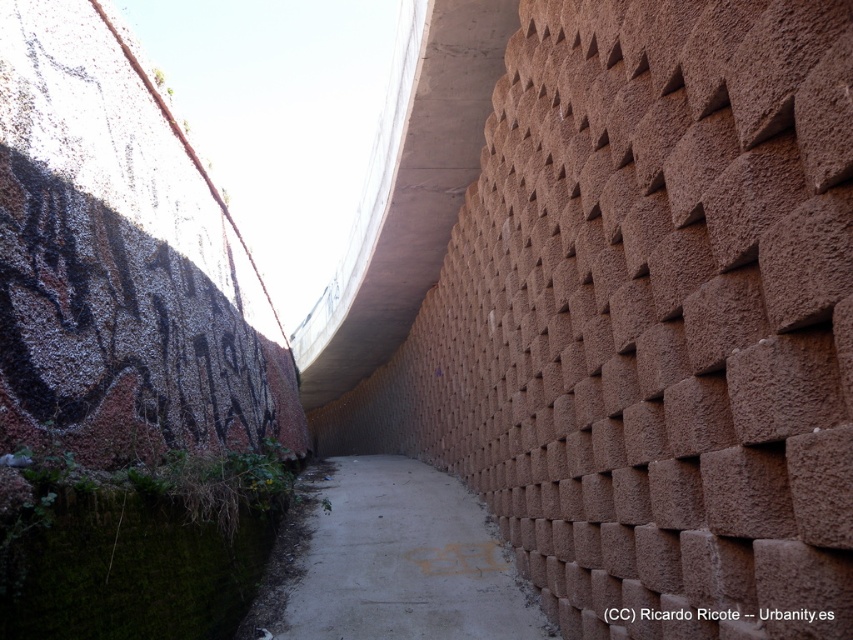
Question: Does concrete sidewalk at center appear on the left side of black graffiti at upper left?

Choices:
 (A) no
 (B) yes

Answer: (B)

Question: Which of the following is the farthest from the observer?

Choices:
 (A) (440, 531)
 (B) (828, 611)

Answer: (A)

Question: Among these points, which one is farthest from the camera?

Choices:
 (A) (820, 612)
 (B) (491, 74)

Answer: (B)

Question: Is concrete at upper center below concrete sidewalk at center?

Choices:
 (A) no
 (B) yes

Answer: (A)

Question: Which of the following is the farthest from the observer?

Choices:
 (A) (402, 157)
 (B) (297, 564)

Answer: (A)

Question: Does concrete sidewalk at center appear on the right side of black graffiti at upper left?

Choices:
 (A) no
 (B) yes

Answer: (A)